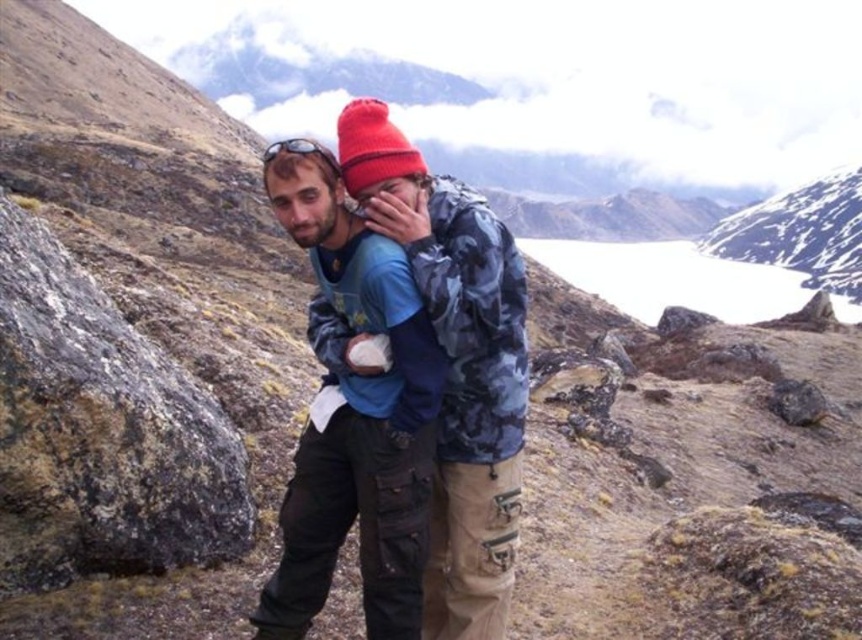
Is rocky gray at left to the right of matte blue shirt at center from the viewer's perspective?

In fact, rocky gray at left is to the left of matte blue shirt at center.

Who is more forward, (222, 417) or (355, 317)?

Positioned in front is point (355, 317).

Image resolution: width=862 pixels, height=640 pixels. Describe the element at coordinates (100, 433) in the screenshot. I see `rocky gray at left` at that location.

I want to click on rocky gray at left, so click(100, 433).

Who is lower down, rocky gray at left or camouflage jacket at center?

rocky gray at left is below.

Does rocky gray at left come in front of camouflage jacket at center?

Yes, it is.

Which is in front, point (225, 524) or point (483, 429)?

Positioned in front is point (483, 429).

This screenshot has width=862, height=640. Identify the location of rocky gray at left. (100, 433).

Can you confirm if matte blue shirt at center is taller than snowy white mountain at upper center?

In fact, matte blue shirt at center may be shorter than snowy white mountain at upper center.

Which is behind, point (301, 589) or point (807, 220)?

Positioned behind is point (807, 220).

Where is `matte blue shirt at center`? Image resolution: width=862 pixels, height=640 pixels. matte blue shirt at center is located at coordinates (355, 417).

At what (x,y) coordinates should I click in order to perform the action: click on matte blue shirt at center. Please return your answer as a coordinate pair (x, y). The image size is (862, 640). Looking at the image, I should click on tap(355, 417).